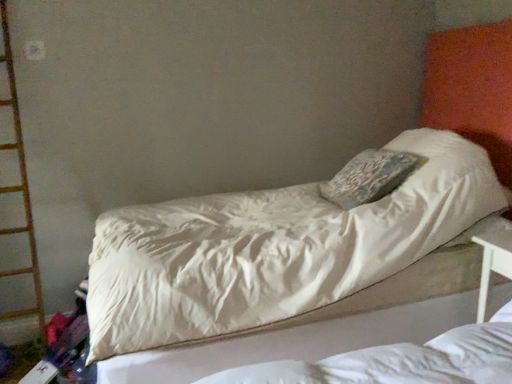
The height and width of the screenshot is (384, 512). Describe the element at coordinates (20, 188) in the screenshot. I see `wooden ladder at left` at that location.

Where is `wooden ladder at left`? This screenshot has width=512, height=384. wooden ladder at left is located at coordinates (20, 188).

What is the approximate height of wooden ladder at left?

5.74 feet.

I want to click on wooden ladder at left, so click(x=20, y=188).